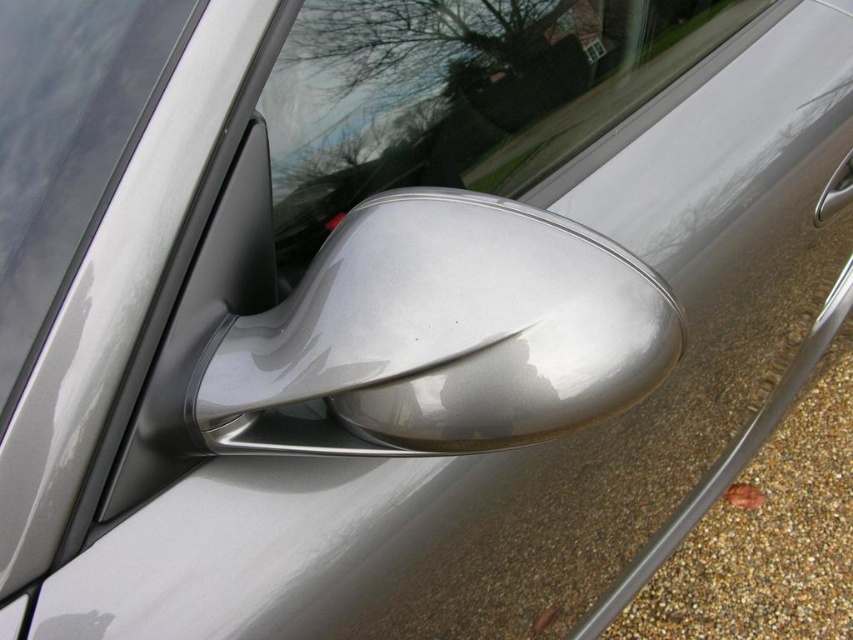
Question: Does satin silver mirror at center appear over transparent glass window at center?

Choices:
 (A) no
 (B) yes

Answer: (A)

Question: Is satin silver mirror at center to the left of glossy metallic car window at center from the viewer's perspective?

Choices:
 (A) yes
 (B) no

Answer: (A)

Question: Which is farther from the glossy metallic car window at center?

Choices:
 (A) transparent glass window at center
 (B) polished silver door handle at lower right

Answer: (B)

Question: Which object appears closest to the camera in this image?

Choices:
 (A) satin silver mirror at center
 (B) polished silver door handle at lower right

Answer: (A)

Question: Can you confirm if satin silver mirror at center is bigger than glossy metallic car window at center?

Choices:
 (A) yes
 (B) no

Answer: (B)

Question: Which point is farther to the camera?

Choices:
 (A) satin silver mirror at center
 (B) transparent glass window at center

Answer: (B)